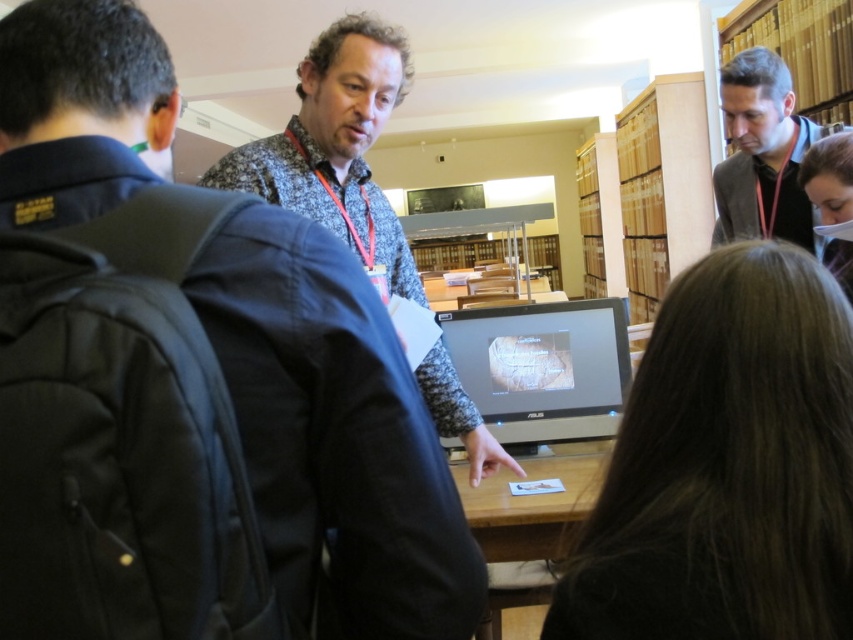
Question: Which object is closer to the camera taking this photo?

Choices:
 (A) wooden table at center
 (B) gray woolen sweater at upper right
 (C) speckled fabric shirt at center

Answer: (C)

Question: Considering the real-world distances, which object is closest to the brown hair at upper center?

Choices:
 (A) satin black monitor at center
 (B) wooden table at center

Answer: (B)

Question: Does speckled fabric shirt at center have a lesser width compared to wooden table at center?

Choices:
 (A) yes
 (B) no

Answer: (B)

Question: Is speckled fabric shirt at center behind gray woolen sweater at upper right?

Choices:
 (A) no
 (B) yes

Answer: (A)

Question: Does brown hair at upper center have a smaller size compared to speckled fabric shirt at center?

Choices:
 (A) no
 (B) yes

Answer: (B)

Question: Which point appears farthest from the camera in this image?

Choices:
 (A) (741, 504)
 (B) (733, 92)
 (C) (621, 376)
 (D) (248, 180)

Answer: (B)